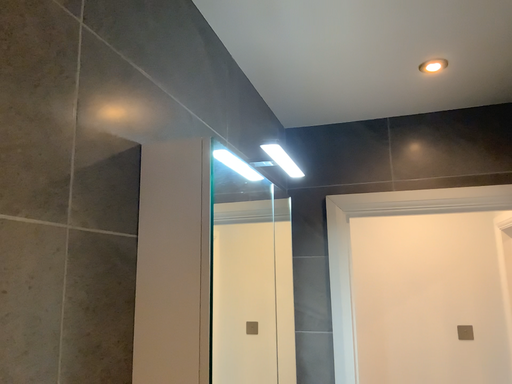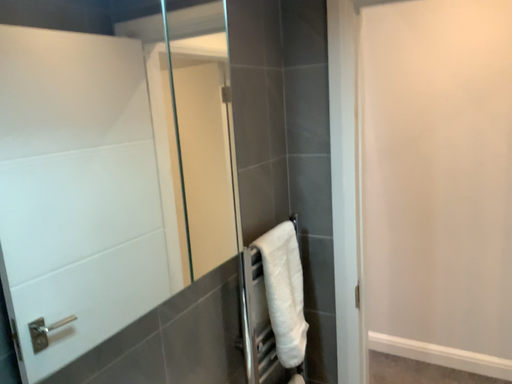
Question: How did the camera likely rotate when shooting the video?

Choices:
 (A) rotated downward
 (B) rotated upward

Answer: (A)